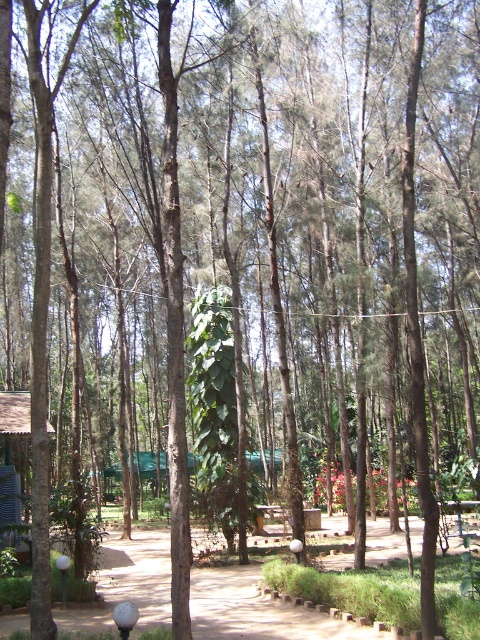
Is dirt path at center closer to the viewer compared to wooden hut at lower left?

Yes, it is in front of wooden hut at lower left.

Who is more distant from viewer, (59, 618) or (10, 515)?

Point (10, 515)

Which is behind, point (151, 588) or point (4, 502)?

Positioned behind is point (4, 502).

Locate an element on the screen. dirt path at center is located at coordinates point(253,609).